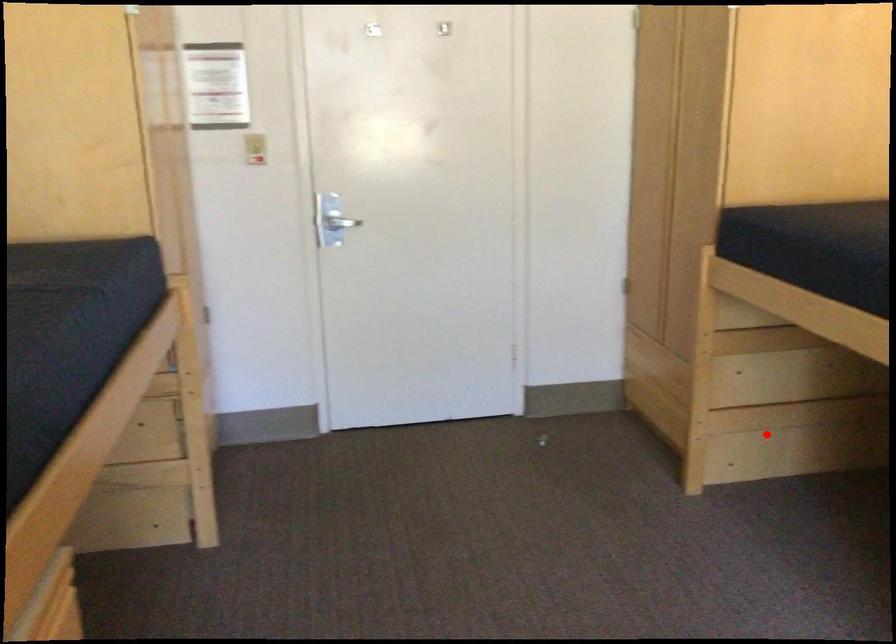
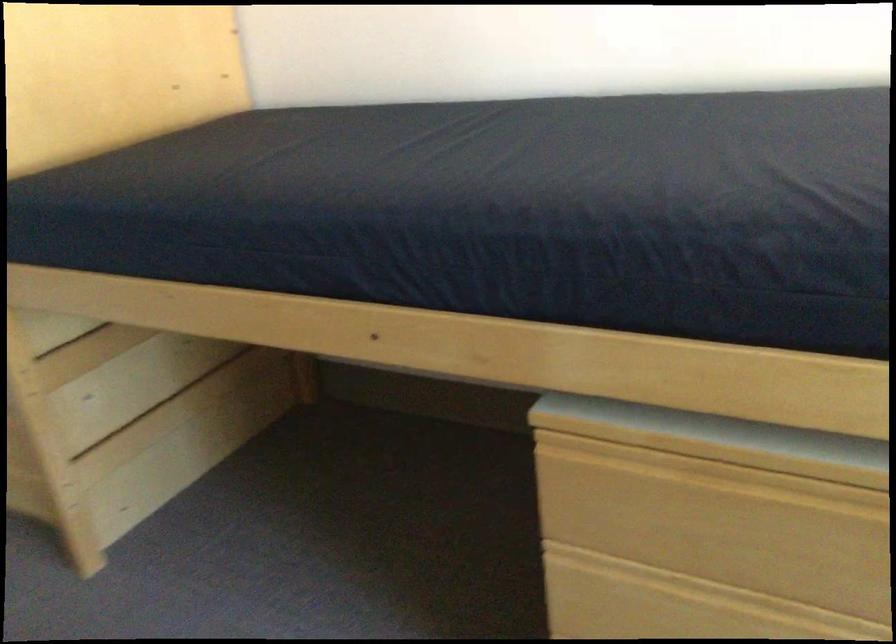
Question: I am providing you with two images of the same scene from different viewpoints. Image1 has a red point marked. In image2, the corresponding 3D location appears at what relative position? Reply with the corresponding letter.

Choices:
 (A) Closer
 (B) Farther

Answer: (A)